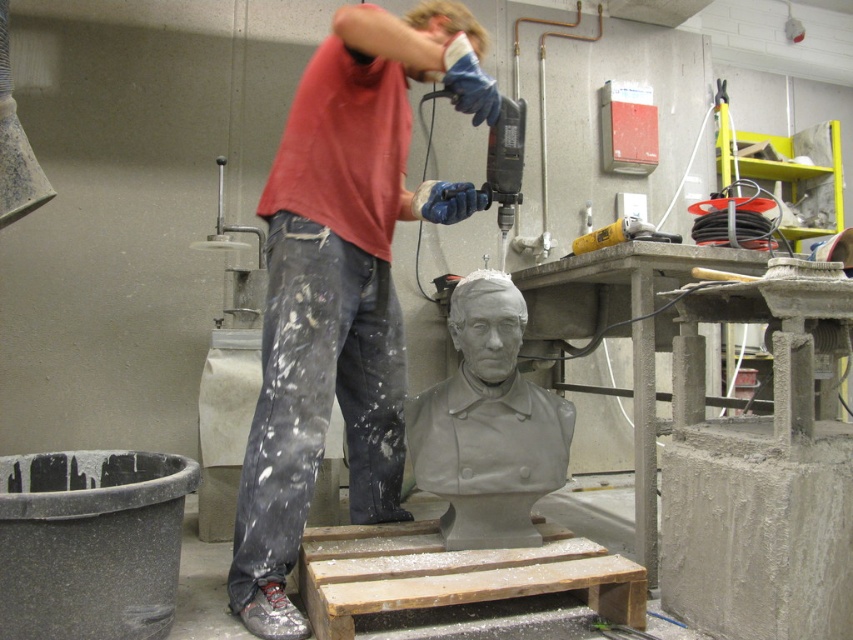
Question: Considering the relative positions of gray matte bust at center and yellow plastic drill at upper center in the image provided, where is gray matte bust at center located with respect to yellow plastic drill at upper center?

Choices:
 (A) above
 (B) below

Answer: (B)

Question: Considering the relative positions of matte gray bust at center and yellow plastic drill at upper center in the image provided, where is matte gray bust at center located with respect to yellow plastic drill at upper center?

Choices:
 (A) below
 (B) above

Answer: (A)

Question: Is matte gray bust at center to the left of yellow plastic drill at upper center from the viewer's perspective?

Choices:
 (A) yes
 (B) no

Answer: (A)

Question: Estimate the real-world distances between objects in this image. Which object is closer to the gray matte bust at center?

Choices:
 (A) matte gray bust at center
 (B) yellow plastic drill at upper center

Answer: (A)

Question: Which point appears farthest from the camera in this image?

Choices:
 (A) (636, 225)
 (B) (573, 422)

Answer: (A)

Question: Which point is closer to the camera?

Choices:
 (A) gray matte bust at center
 (B) yellow plastic drill at upper center
 (C) matte gray bust at center

Answer: (C)